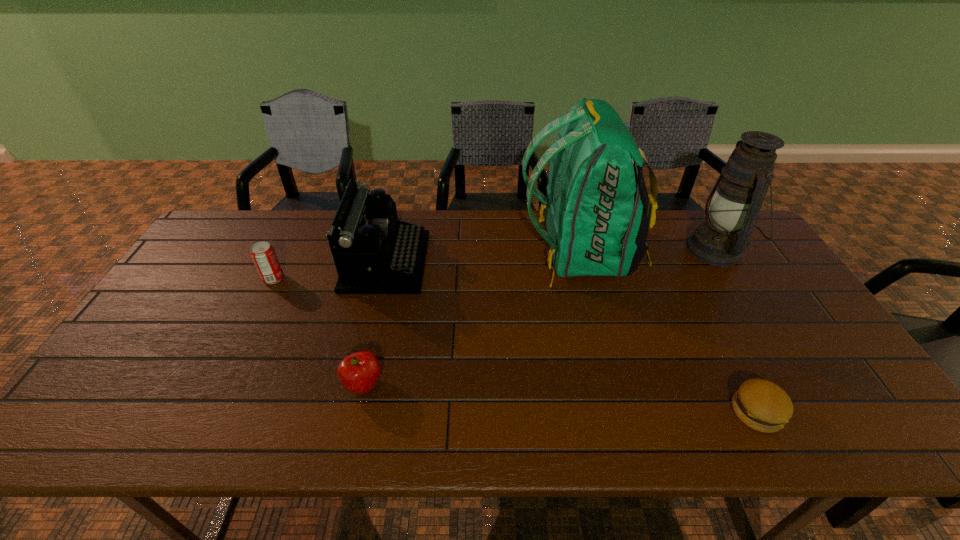
What are the coordinates of `the tallest object` in the screenshot? It's located at (598, 212).

The image size is (960, 540). I want to click on the fourth object from left to right, so click(x=598, y=212).

I want to click on the second tallest object, so click(x=734, y=203).

Identify the location of the fourth shortest object. (375, 253).

The height and width of the screenshot is (540, 960). Find the location of `soda can`. soda can is located at coordinates (263, 255).

Where is `apple`? Image resolution: width=960 pixels, height=540 pixels. apple is located at coordinates (359, 372).

Where is `hamburger`? hamburger is located at coordinates (762, 405).

You are a GUI agent. You are given a task and a screenshot of the screen. Output one action in this format:
    pyautogui.click(x=<x>, y=<y>)
    Task: Click on the free space located 0.390m on the back of the fourth object from left to right
    This screenshot has height=540, width=960.
    Given the screenshot: What is the action you would take?
    pyautogui.click(x=397, y=252)

Image resolution: width=960 pixels, height=540 pixels. I want to click on free space located on the back of the fourth object from left to right, so click(444, 252).

This screenshot has width=960, height=540. What are the coordinates of `free space located on the back of the fourth object from left to right` in the screenshot? It's located at (422, 252).